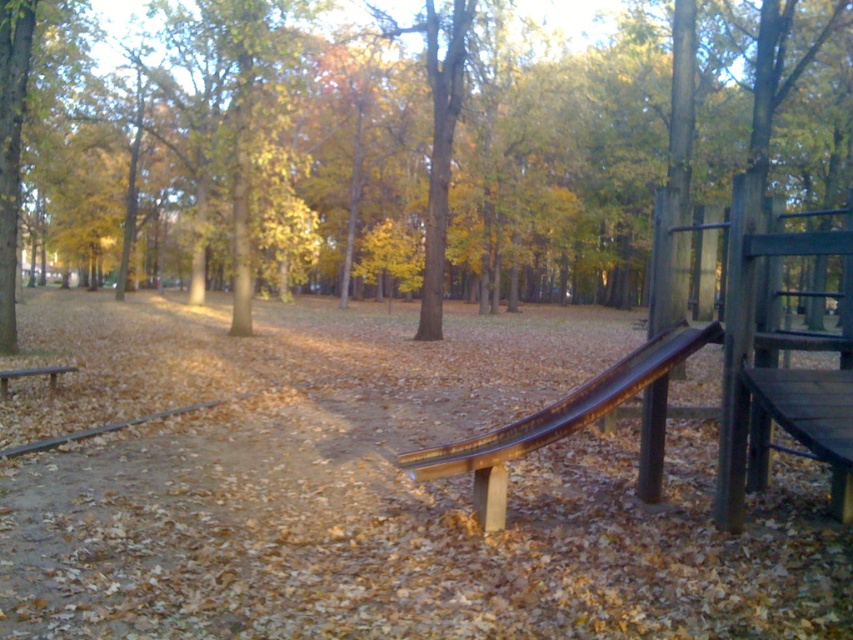
Question: Can you confirm if wooden bench at center is positioned to the right of wooden bench at left?

Choices:
 (A) no
 (B) yes

Answer: (B)

Question: Among these objects, which one is farthest from the camera?

Choices:
 (A) wooden bench at center
 (B) wooden bench at left

Answer: (B)

Question: Does wooden bench at center appear under wooden bench at left?

Choices:
 (A) no
 (B) yes

Answer: (B)

Question: Is wooden bench at center below wooden bench at left?

Choices:
 (A) no
 (B) yes

Answer: (B)

Question: Which point is closer to the camera?

Choices:
 (A) (1, 394)
 (B) (489, 468)

Answer: (B)